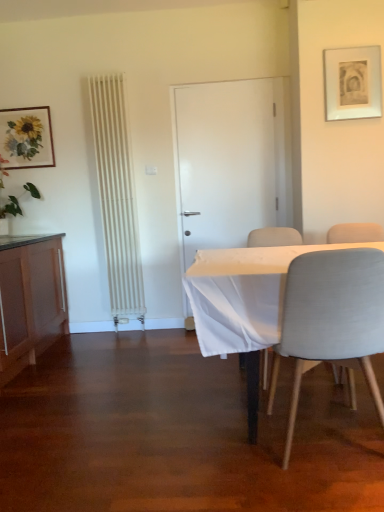
Question: From the image's perspective, is matte wood cabinet at left located beneath matte white picture frame at upper right, the 2th picture frame in the left-to-right sequence?

Choices:
 (A) yes
 (B) no

Answer: (A)

Question: From a real-world perspective, is matte wood cabinet at left below matte white picture frame at upper right, marked as the first picture frame in a front-to-back arrangement?

Choices:
 (A) no
 (B) yes

Answer: (B)

Question: Can you confirm if matte wood cabinet at left is wider than matte white picture frame at upper right, marked as the first picture frame in a front-to-back arrangement?

Choices:
 (A) yes
 (B) no

Answer: (A)

Question: Does matte wood cabinet at left have a greater height compared to matte white picture frame at upper right, the 2th picture frame in the left-to-right sequence?

Choices:
 (A) yes
 (B) no

Answer: (A)

Question: Considering the relative positions of matte wood cabinet at left and matte white picture frame at upper right, which appears as the second picture frame when viewed from the back, in the image provided, is matte wood cabinet at left to the left of matte white picture frame at upper right, which appears as the second picture frame when viewed from the back, from the viewer's perspective?

Choices:
 (A) yes
 (B) no

Answer: (A)

Question: From a real-world perspective, is light gray fabric chair at right, the second chair positioned from the back, above or below matte wooden picture frame at upper left, the 1th picture frame when ordered from back to front?

Choices:
 (A) below
 (B) above

Answer: (A)

Question: Is light gray fabric chair at right, the second chair positioned from the back, spatially inside matte wooden picture frame at upper left, the 1th picture frame when ordered from back to front, or outside of it?

Choices:
 (A) outside
 (B) inside

Answer: (A)

Question: Considering the positions of light gray fabric chair at right, arranged as the second chair when viewed from the front, and matte wooden picture frame at upper left, arranged as the 2th picture frame when viewed from the front, in the image, is light gray fabric chair at right, arranged as the second chair when viewed from the front, bigger or smaller than matte wooden picture frame at upper left, arranged as the 2th picture frame when viewed from the front,?

Choices:
 (A) small
 (B) big

Answer: (B)

Question: In the image, is light gray fabric chair at right, arranged as the second chair when viewed from the front, on the left side or the right side of matte wooden picture frame at upper left, the 1th picture frame when ordered from back to front?

Choices:
 (A) left
 (B) right

Answer: (B)

Question: Is matte white picture frame at upper right, which appears as the second picture frame when viewed from the back, spatially inside light gray fabric chair at right, arranged as the second chair when viewed from the front, or outside of it?

Choices:
 (A) inside
 (B) outside

Answer: (B)

Question: Is point (349, 72) positioned closer to the camera than point (354, 396)?

Choices:
 (A) closer
 (B) farther

Answer: (B)

Question: From a real-world perspective, relative to light gray fabric chair at right, the second chair positioned from the back, is matte white picture frame at upper right, which ranks as the 1th picture frame in right-to-left order, vertically above or below?

Choices:
 (A) above
 (B) below

Answer: (A)

Question: In the image, is matte white picture frame at upper right, the 2th picture frame in the left-to-right sequence, positioned in front of or behind light gray fabric chair at right, the second chair positioned from the back?

Choices:
 (A) behind
 (B) front

Answer: (A)

Question: From a real-world perspective, relative to green leafy plant at left, is matte wood cabinet at left vertically above or below?

Choices:
 (A) above
 (B) below

Answer: (B)

Question: In the image, is matte wood cabinet at left positioned in front of or behind green leafy plant at left?

Choices:
 (A) behind
 (B) front

Answer: (B)